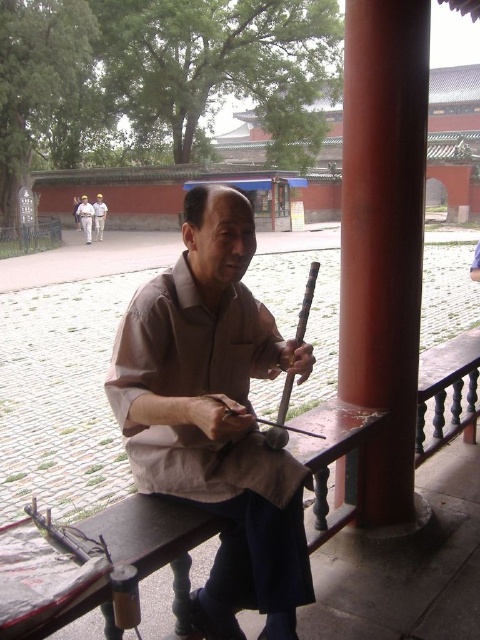
Is point (249, 259) behind point (88, 209)?

No, (249, 259) is closer to viewer.

Does brown matte shirt at center lie behind light brown cotton shirt at center?

No, it is in front of light brown cotton shirt at center.

Does point (251, 483) lie behind point (85, 196)?

No, (251, 483) is closer to viewer.

Identify the location of brown matte shirt at center. The height and width of the screenshot is (640, 480). (216, 413).

From the picture: Which is below, brown matte shirt at center or brown cotton shirt at center?

brown matte shirt at center is lower down.

Is point (302, 540) less distant than point (94, 224)?

Yes, point (302, 540) is in front of point (94, 224).

I want to click on brown matte shirt at center, so click(x=216, y=413).

In the scene shown: Does brown matte shirt at center have a larger size compared to smooth red wood at center?

Correct, brown matte shirt at center is larger in size than smooth red wood at center.

Describe the element at coordinates (216, 413) in the screenshot. I see `brown matte shirt at center` at that location.

This screenshot has width=480, height=640. Identify the location of brown matte shirt at center. (216, 413).

You are a GUI agent. You are given a task and a screenshot of the screen. Output one action in this format:
    pyautogui.click(x=<x>, y=<y>)
    Task: Click on the brown matte shirt at center
    This screenshot has width=480, height=640.
    Given the screenshot: What is the action you would take?
    pyautogui.click(x=216, y=413)